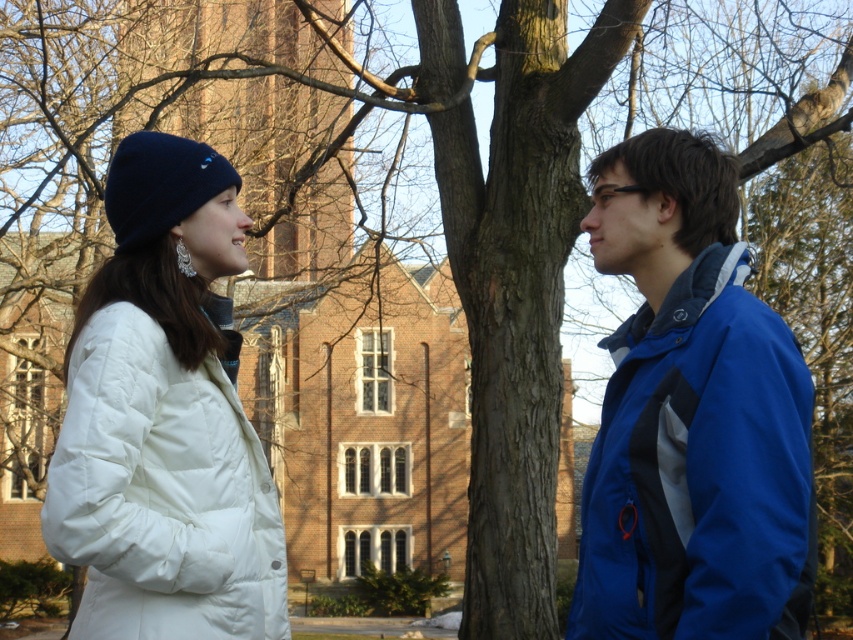
You are a photographer trying to capture both the blue softshell jacket at right and the white puffy coat at left in the same frame. Based on their sizes, which jacket should you focus on to ensure both are fully visible in the photo?

The blue softshell jacket at right is bigger than the white puffy coat at left, so you should focus on the blue softshell jacket at right to ensure both are fully visible in the photo.

You are standing at the point with coordinates point (155,298) and want to walk to the point with coordinates point (595,264). Is the destination point behind you or in front of you?

The destination point point (595,264) is behind point (155,298), so it is behind you.